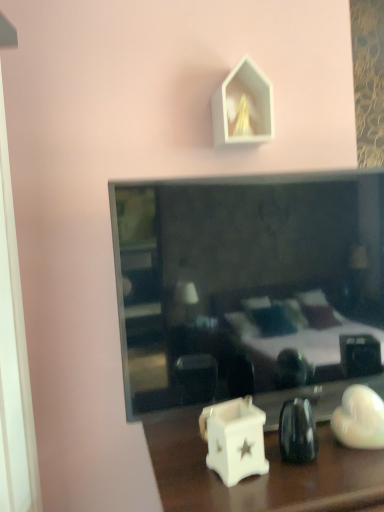
In the scene shown: Measure the distance between white glossy candle holder at lower center and camera.

They are 27.96 inches apart.

The width and height of the screenshot is (384, 512). What do you see at coordinates (269, 463) in the screenshot?
I see `white glossy candle holder at lower center` at bounding box center [269, 463].

What do you see at coordinates (249, 289) in the screenshot? The image size is (384, 512). I see `smooth glass mirror at center` at bounding box center [249, 289].

What do you see at coordinates (243, 106) in the screenshot? Image resolution: width=384 pixels, height=512 pixels. I see `white matte house-shaped object at upper center` at bounding box center [243, 106].

The image size is (384, 512). Identify the location of white glossy candle holder at lower center. (269, 463).

Considering the positions of objects white glossy candle holder at lower center and smooth glass mirror at center in the image provided, who is in front, white glossy candle holder at lower center or smooth glass mirror at center?

white glossy candle holder at lower center is more forward.

Considering the positions of point (326, 432) and point (355, 298), is point (326, 432) closer or farther from the camera than point (355, 298)?

Point (326, 432) appears to be closer to the viewer than point (355, 298).

Considering their positions, is white ceramic candle holder at lower center located in front of or behind smooth glass mirror at center?

Visually, white ceramic candle holder at lower center is located in front of smooth glass mirror at center.

How much distance is there between white ceramic candle holder at lower center and smooth glass mirror at center?

They are 12.16 inches apart.

Where is `candle holder in front of the smooth glass mirror at center`? The image size is (384, 512). candle holder in front of the smooth glass mirror at center is located at coordinates (234, 439).

In the scene shown: Which object is positioned more to the right, white ceramic candle holder at lower center or smooth glass mirror at center?

smooth glass mirror at center is more to the right.

Considering the sizes of objects white ceramic candle holder at lower center and white matte house-shaped object at upper center in the image provided, who is smaller, white ceramic candle holder at lower center or white matte house-shaped object at upper center?

white ceramic candle holder at lower center is smaller.

Is white ceramic candle holder at lower center far from white matte house-shaped object at upper center?

white ceramic candle holder at lower center is actually quite close to white matte house-shaped object at upper center.

From the image's perspective, which is below, white ceramic candle holder at lower center or white matte house-shaped object at upper center?

white ceramic candle holder at lower center appears lower in the image.

In order to click on table that is in front of the white ceramic candle holder at lower center in this screenshot , I will do click(x=269, y=463).

Considering the positions of point (288, 507) and point (224, 418), is point (288, 507) closer or farther from the camera than point (224, 418)?

Point (288, 507).

Is white ceramic candle holder at lower center at the back of white glossy candle holder at lower center?

No, white glossy candle holder at lower center is not facing away from white ceramic candle holder at lower center.

Can you tell me how much white glossy candle holder at lower center and white ceramic candle holder at lower center differ in facing direction?

They differ by 8.38 degrees in their facing directions.

Is smooth glass mirror at center not close to white glossy candle holder at lower center?

No.

Looking at their sizes, would you say smooth glass mirror at center is wider or thinner than white glossy candle holder at lower center?

Clearly, smooth glass mirror at center has less width compared to white glossy candle holder at lower center.

Based on the photo, how many degrees apart are the facing directions of smooth glass mirror at center and white glossy candle holder at lower center?

There is a 0.931-degree angle between the facing directions of smooth glass mirror at center and white glossy candle holder at lower center.

Which of these two, white matte house-shaped object at upper center or white glossy candle holder at lower center, stands shorter?

white matte house-shaped object at upper center.

Based on the photo, from the image's perspective, relative to white glossy candle holder at lower center, is white matte house-shaped object at upper center above or below?

Based on their image positions, white matte house-shaped object at upper center is located above white glossy candle holder at lower center.

Can you confirm if white matte house-shaped object at upper center is bigger than white glossy candle holder at lower center?

No.

How different are the orientations of white matte house-shaped object at upper center and smooth glass mirror at center in degrees?

The angular difference between white matte house-shaped object at upper center and smooth glass mirror at center is 0.317 degrees.

From the image's perspective, does white matte house-shaped object at upper center appear lower than smooth glass mirror at center?

No, from the image's perspective, white matte house-shaped object at upper center is not below smooth glass mirror at center.

Considering the relative sizes of white matte house-shaped object at upper center and smooth glass mirror at center in the image provided, is white matte house-shaped object at upper center shorter than smooth glass mirror at center?

Yes, white matte house-shaped object at upper center is shorter than smooth glass mirror at center.

The width and height of the screenshot is (384, 512). I want to click on mirror behind the white glossy candle holder at lower center, so click(x=249, y=289).

The height and width of the screenshot is (512, 384). In order to click on candle holder in front of the smooth glass mirror at center in this screenshot , I will do `click(234, 439)`.

When comparing their distances from white matte house-shaped object at upper center, does white glossy candle holder at lower center or white ceramic candle holder at lower center seem further?

white glossy candle holder at lower center is positioned further to the anchor white matte house-shaped object at upper center.

When comparing their distances from white matte house-shaped object at upper center, does smooth glass mirror at center or white ceramic candle holder at lower center seem closer?

smooth glass mirror at center lies closer to white matte house-shaped object at upper center than the other object.

Looking at this image, considering their positions, is white matte house-shaped object at upper center positioned closer to white glossy candle holder at lower center than white ceramic candle holder at lower center?

The object closer to white glossy candle holder at lower center is white ceramic candle holder at lower center.

From the picture: When comparing their distances from white glossy candle holder at lower center, does smooth glass mirror at center or white ceramic candle holder at lower center seem closer?

The object closer to white glossy candle holder at lower center is white ceramic candle holder at lower center.

Estimate the real-world distances between objects in this image. Which object is further from white matte house-shaped object at upper center, white ceramic candle holder at lower center or smooth glass mirror at center?

white ceramic candle holder at lower center lies further to white matte house-shaped object at upper center than the other object.

Looking at the image, which one is located closer to white ceramic candle holder at lower center, white matte house-shaped object at upper center or white glossy candle holder at lower center?

Among the two, white glossy candle holder at lower center is located nearer to white ceramic candle holder at lower center.

Which object lies further to the anchor point white ceramic candle holder at lower center, smooth glass mirror at center or white glossy candle holder at lower center?

Based on the image, smooth glass mirror at center appears to be further to white ceramic candle holder at lower center.

Estimate the real-world distances between objects in this image. Which object is closer to white ceramic candle holder at lower center, white glossy candle holder at lower center or white matte house-shaped object at upper center?

Among the two, white glossy candle holder at lower center is located nearer to white ceramic candle holder at lower center.

The width and height of the screenshot is (384, 512). In order to click on mirror between white matte house-shaped object at upper center and white glossy candle holder at lower center in the up-down direction in this screenshot , I will do `click(249, 289)`.

This screenshot has width=384, height=512. What are the coordinates of `candle holder between smooth glass mirror at center and white glossy candle holder at lower center vertically` in the screenshot? It's located at (234, 439).

Find the location of `mirror between white matte house-shaped object at upper center and white ceramic candle holder at lower center in the vertical direction`. mirror between white matte house-shaped object at upper center and white ceramic candle holder at lower center in the vertical direction is located at coordinates (249, 289).

Where is `candle holder between white matte house-shaped object at upper center and white glossy candle holder at lower center in the vertical direction`? candle holder between white matte house-shaped object at upper center and white glossy candle holder at lower center in the vertical direction is located at coordinates (234, 439).